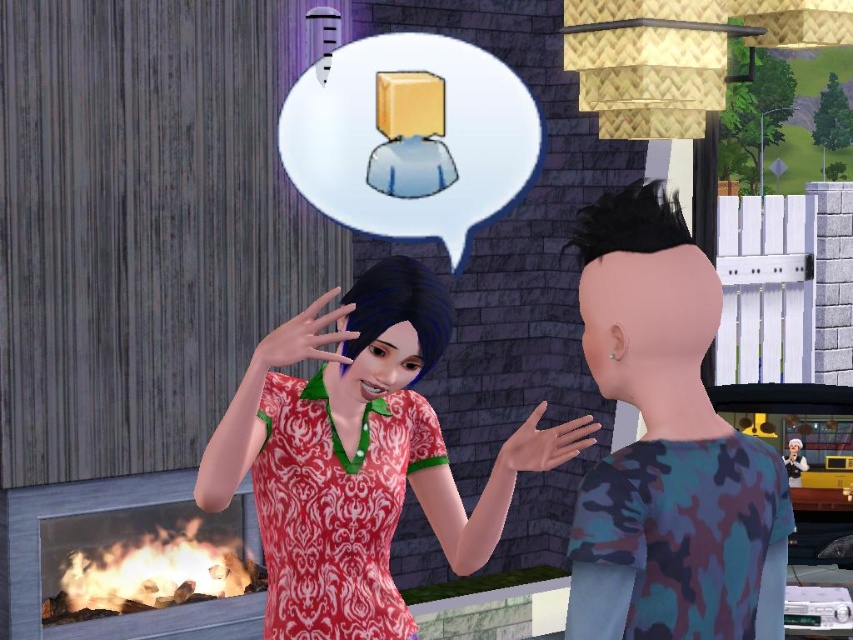
You are standing at the point marked as point (358, 458) in the image. What is the object located exactly at that point?

The object located exactly at point (358, 458) is the patterned fabric dress at center.

In the scene from The Sims, there are two characters wearing a camouflage shirt at right and a dull red fabric dress at center. Which character is positioned higher up compared to the other?

The camouflage shirt at right is located above the dull red fabric dress at center, so the character wearing the camouflage shirt at right is positioned higher up.